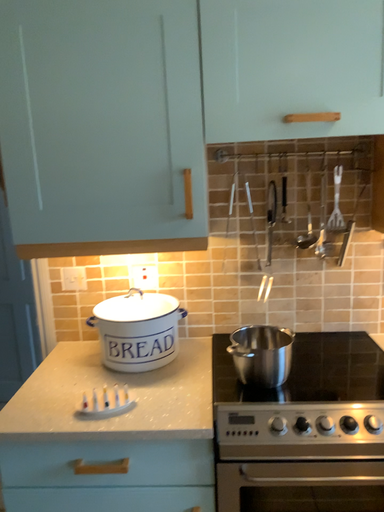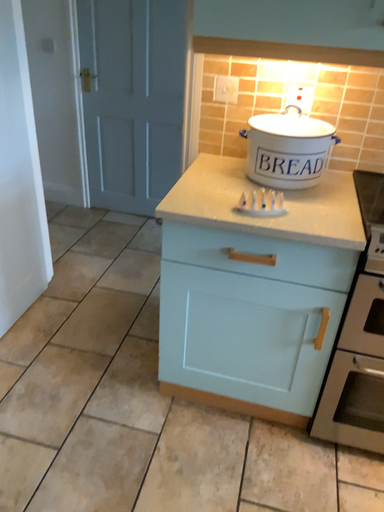
Question: How did the camera likely rotate when shooting the video?

Choices:
 (A) rotated left
 (B) rotated right

Answer: (A)